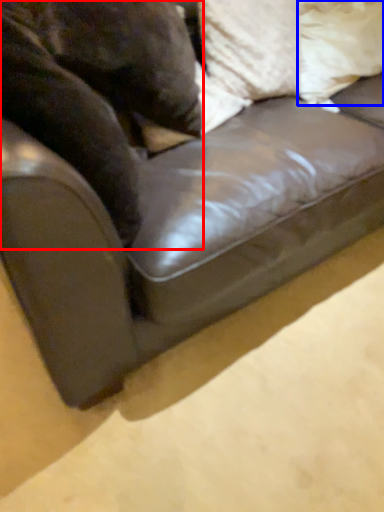
Question: Which point is further to the camera, animal (highlighted by a red box) or pillow (highlighted by a blue box)?

Choices:
 (A) animal
 (B) pillow

Answer: (B)